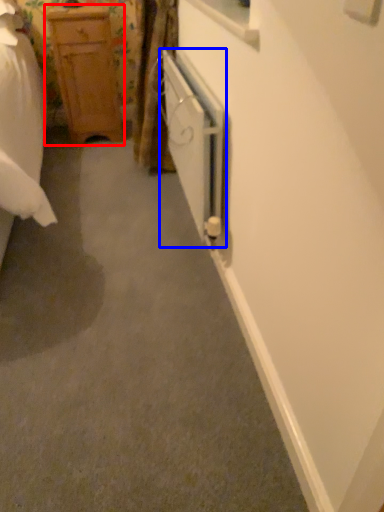
Question: Which object is further to the camera taking this photo, chest of drawers (highlighted by a red box) or screen door (highlighted by a blue box)?

Choices:
 (A) chest of drawers
 (B) screen door

Answer: (A)